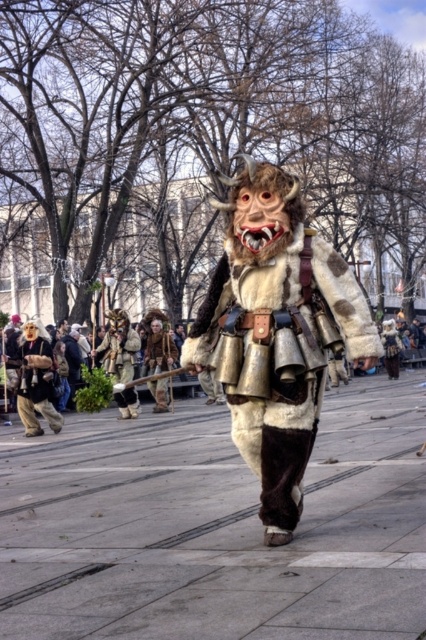
You are a festival attendee standing at the edge of the plaza. You see the concrete paving at center and the furry costume at center. Which object is positioned to the left of the other?

The concrete paving at center is to the left of the furry costume at center.

You are planning to walk through the festival area shown in the image. You see the concrete paving at center and the furry costume at center. Which one is wider?

The concrete paving at center is wider than the furry costume at center.